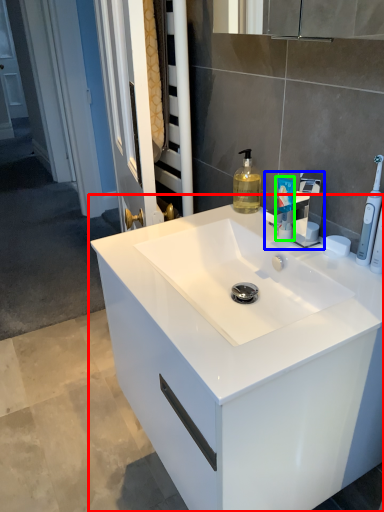
Question: Considering the real-world distances, which object is farthest from bathroom cabinet (highlighted by a red box)? tap (highlighted by a blue box) or toiletry (highlighted by a green box)?

Choices:
 (A) tap
 (B) toiletry

Answer: (B)